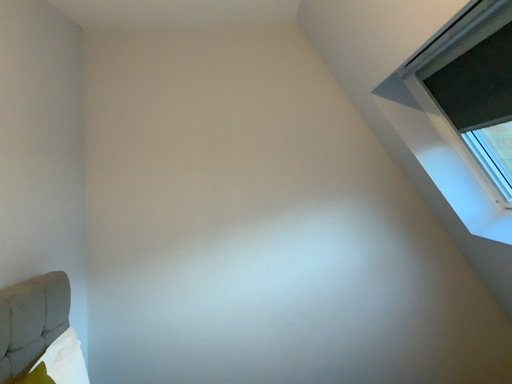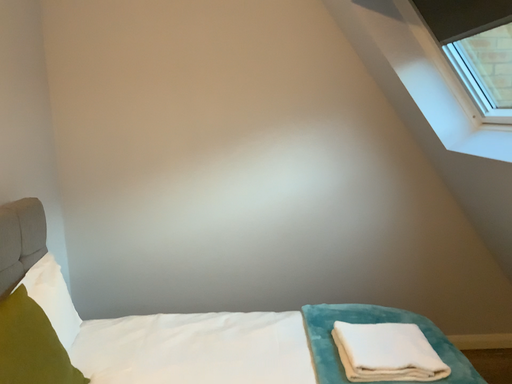
Question: How did the camera likely rotate when shooting the video?

Choices:
 (A) rotated upward
 (B) rotated downward

Answer: (B)